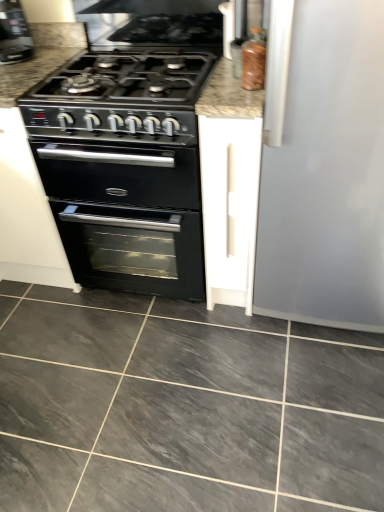
Question: Is there a large distance between black plastic coffee machine at upper left and white matte cabinet at center?

Choices:
 (A) yes
 (B) no

Answer: (A)

Question: Can you confirm if black plastic coffee machine at upper left is smaller than white matte cabinet at center?

Choices:
 (A) yes
 (B) no

Answer: (A)

Question: Can you confirm if black plastic coffee machine at upper left is positioned to the left of white matte cabinet at center?

Choices:
 (A) yes
 (B) no

Answer: (A)

Question: Is black plastic coffee machine at upper left shorter than white matte cabinet at center?

Choices:
 (A) yes
 (B) no

Answer: (A)

Question: Could you tell me if black plastic coffee machine at upper left is facing white matte cabinet at center?

Choices:
 (A) yes
 (B) no

Answer: (B)

Question: Is marble countertop at center taller or shorter than black matte oven at center?

Choices:
 (A) short
 (B) tall

Answer: (A)

Question: Is marble countertop at center wider or thinner than black matte oven at center?

Choices:
 (A) thin
 (B) wide

Answer: (A)

Question: Looking at the image, does marble countertop at center seem bigger or smaller compared to black matte oven at center?

Choices:
 (A) big
 (B) small

Answer: (B)

Question: Would you say marble countertop at center is inside or outside black matte oven at center?

Choices:
 (A) outside
 (B) inside

Answer: (A)

Question: From a real-world perspective, is black plastic coffee machine at upper left physically located above or below white matte cabinet at center?

Choices:
 (A) below
 (B) above

Answer: (B)

Question: From the image's perspective, is black plastic coffee machine at upper left above or below white matte cabinet at center?

Choices:
 (A) above
 (B) below

Answer: (A)

Question: Is black plastic coffee machine at upper left taller or shorter than white matte cabinet at center?

Choices:
 (A) tall
 (B) short

Answer: (B)

Question: Is black plastic coffee machine at upper left to the left or to the right of white matte cabinet at center in the image?

Choices:
 (A) right
 (B) left

Answer: (B)

Question: Would you say gray marble floor at center is to the left or to the right of black matte oven at center in the picture?

Choices:
 (A) right
 (B) left

Answer: (A)

Question: Considering the positions of gray marble floor at center and black matte oven at center in the image, is gray marble floor at center bigger or smaller than black matte oven at center?

Choices:
 (A) small
 (B) big

Answer: (A)